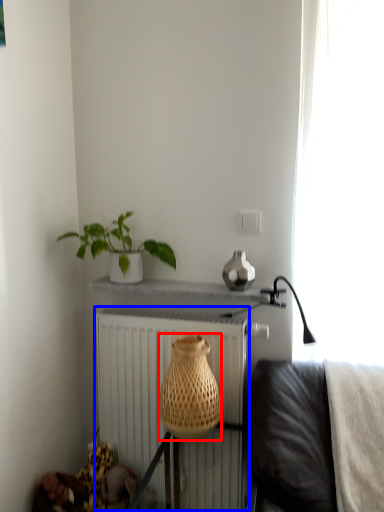
Question: Among these objects, which one is nearest to the camera, basket (highlighted by a red box) or radiator (highlighted by a blue box)?

Choices:
 (A) basket
 (B) radiator

Answer: (A)